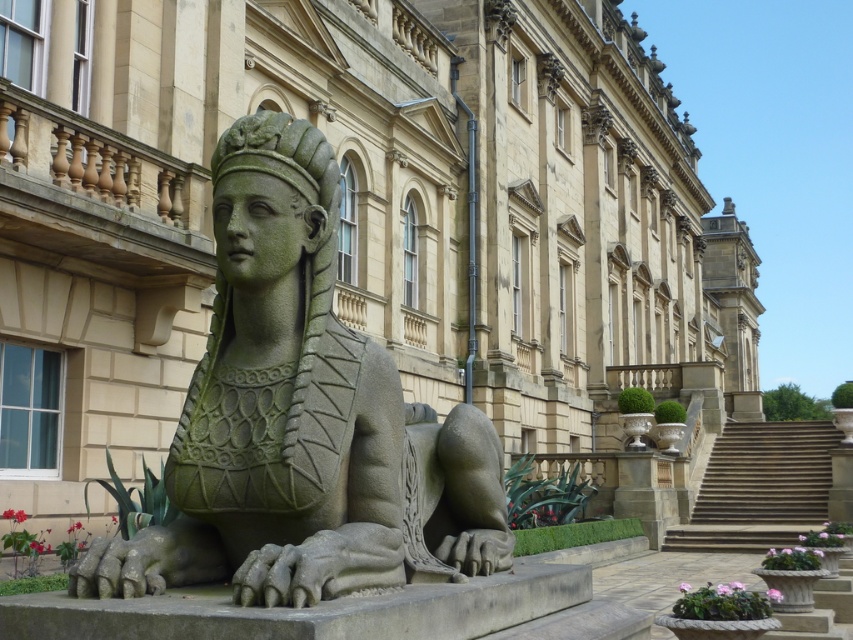
Is green stone sphinx at center behind stone stairs at center?

No, green stone sphinx at center is closer to the viewer.

Which of these two, green stone sphinx at center or stone stairs at center, stands shorter?

stone stairs at center is shorter.

Which is in front, point (374, 572) or point (740, 515)?

Positioned in front is point (374, 572).

Identify the location of green stone sphinx at center. (302, 419).